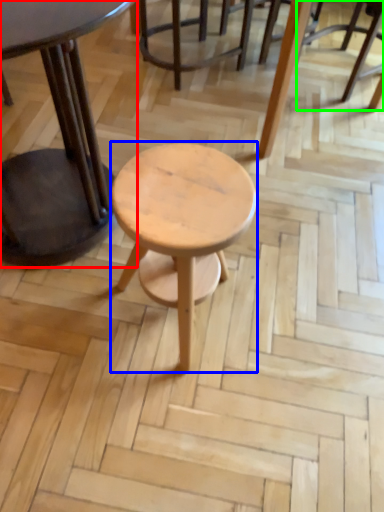
Question: Considering the real-world distances, which object is farthest from table (highlighted by a red box)? stool (highlighted by a blue box) or chair (highlighted by a green box)?

Choices:
 (A) stool
 (B) chair

Answer: (B)